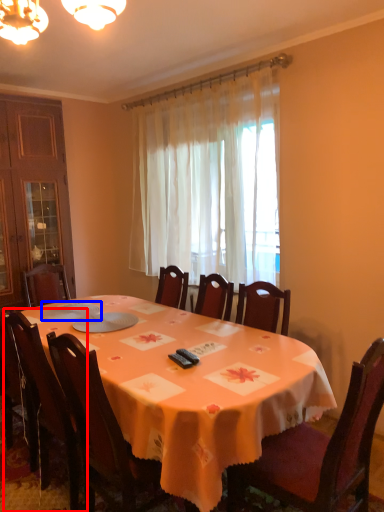
Question: Which object appears farthest to the camera in this image, chair (highlighted by a red box) or tableware (highlighted by a blue box)?

Choices:
 (A) chair
 (B) tableware

Answer: (B)